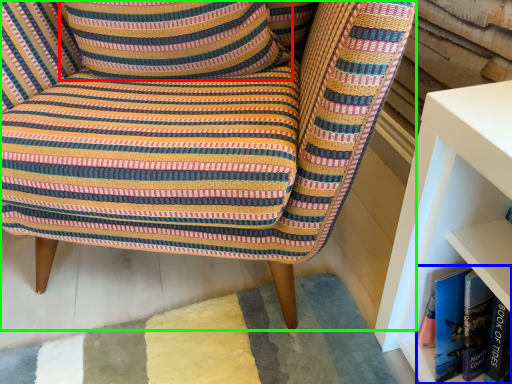
Question: Which object is the farthest from pillow (highlighted by a red box)? Choose among these: book (highlighted by a blue box) or chair (highlighted by a green box).

Choices:
 (A) book
 (B) chair

Answer: (A)